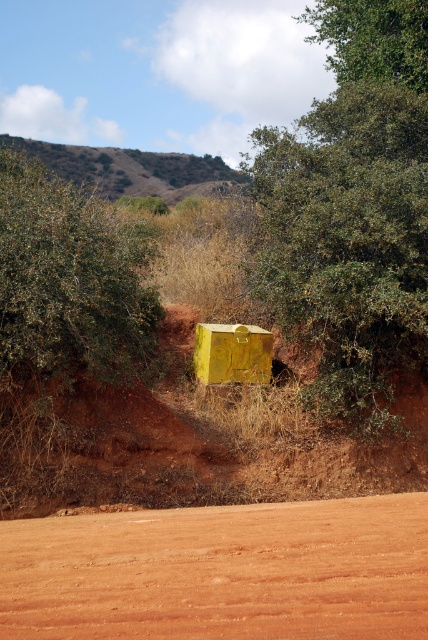
Question: Does brown sandy dirt at lower center appear under green leafy tree at upper center?

Choices:
 (A) no
 (B) yes

Answer: (B)

Question: Is brown sandy dirt at lower center to the right of green leafy tree at upper center from the viewer's perspective?

Choices:
 (A) yes
 (B) no

Answer: (B)

Question: Which of these objects is positioned farthest from the green leafy tree at upper center?

Choices:
 (A) green leafy tree at center
 (B) green leafy bush at left

Answer: (B)

Question: Which point is farther to the camera?

Choices:
 (A) brown sandy dirt at lower center
 (B) green leafy tree at center
 (C) green leafy bush at left

Answer: (B)

Question: Which object appears farthest from the camera in this image?

Choices:
 (A) brown sandy dirt at lower center
 (B) green leafy tree at center
 (C) green leafy tree at upper center
 (D) green leafy bush at left

Answer: (C)

Question: Can you confirm if brown sandy dirt at lower center is positioned below green leafy tree at center?

Choices:
 (A) yes
 (B) no

Answer: (A)